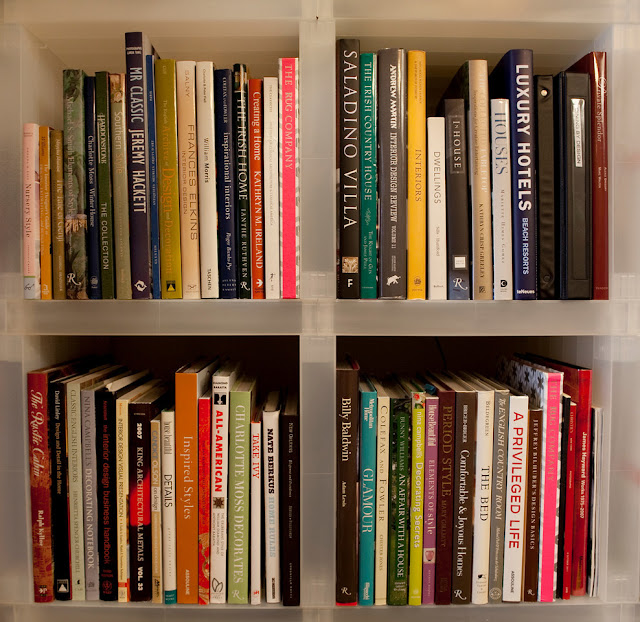
This screenshot has width=640, height=622. What are the coordinates of `redbooks` in the screenshot? It's located at (588, 404), (205, 434), (43, 412), (288, 213), (253, 207), (596, 214).